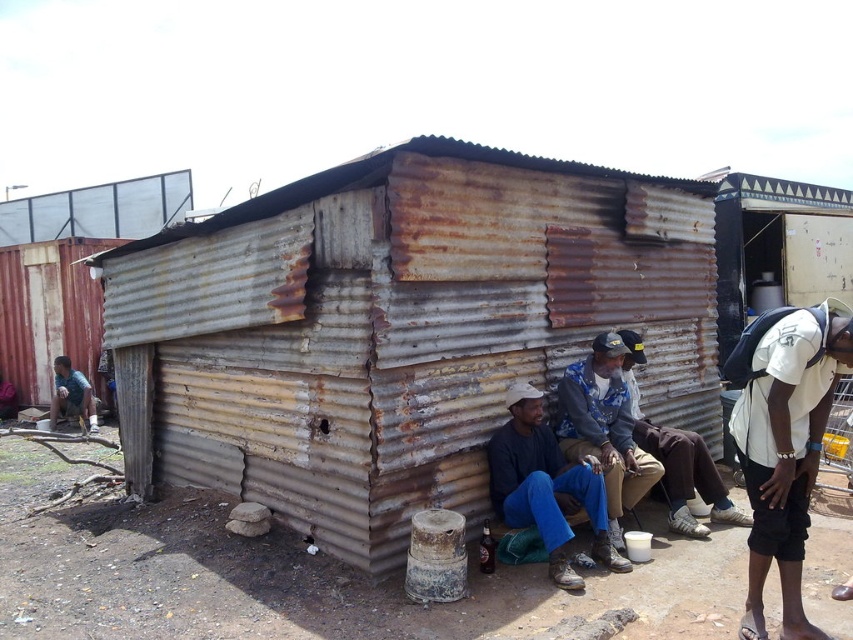
Question: Does blue denim pants at center appear under dark blue jeans at center?

Choices:
 (A) yes
 (B) no

Answer: (B)

Question: Does white fabric backpack at right lie behind dark blue jeans at center?

Choices:
 (A) no
 (B) yes

Answer: (A)

Question: Estimate the real-world distances between objects in this image. Which object is closer to the rusty corrugated metal hut at center?

Choices:
 (A) blue jeans at center
 (B) rusty corrugated metal hut at upper right
 (C) blue denim pants at center
 (D) dark blue jeans at center

Answer: (A)

Question: Which point is closer to the camera?

Choices:
 (A) (733, 252)
 (B) (671, 435)
 (C) (561, 460)
 (D) (772, 396)

Answer: (D)

Question: Among these objects, which one is farthest from the camera?

Choices:
 (A) dark blue jeans at center
 (B) rusty corrugated metal hut at center

Answer: (A)

Question: Does white fabric backpack at right have a smaller size compared to blue jeans at center?

Choices:
 (A) no
 (B) yes

Answer: (B)